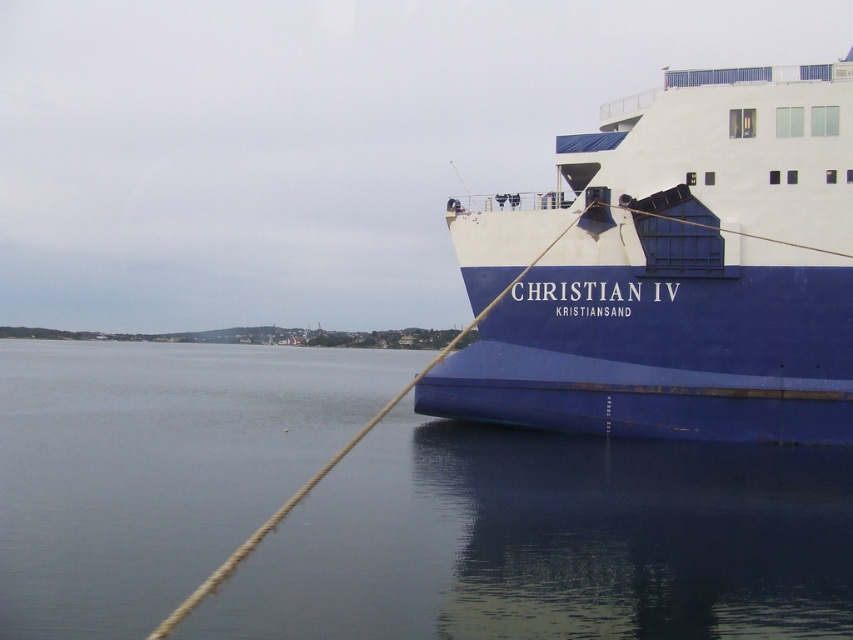
You are a dock worker who needs to secure the blue matte ship at right to the dock using a rope that is 15 feet long. Based on the image, will the rope at right be long enough to reach the ship?

The blue matte ship at right is 16.37 feet from the rope at right. Since the rope is only 15 feet long, it will not be long enough to reach the ship.

You are a dock worker checking the mooring lines. You see the blue matte ship at right and the rope at right. Which object is positioned higher in the image?

The blue matte ship at right is located above the rope at right, so it is positioned higher in the image.

You are standing on the dock next to the ferry named Christian IV. You see the blue water at lower left and the rope at right. Which object is taller from your viewpoint?

The rope at right is taller than the blue water at lower left.